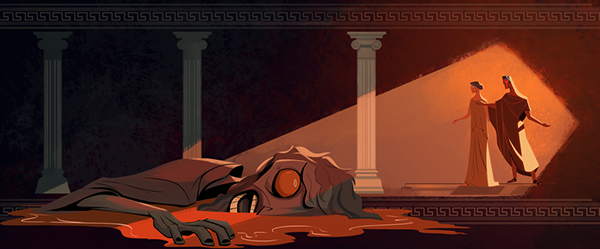
Identify the location of greek style border. This screenshot has height=249, width=600. (473, 17), (473, 213).